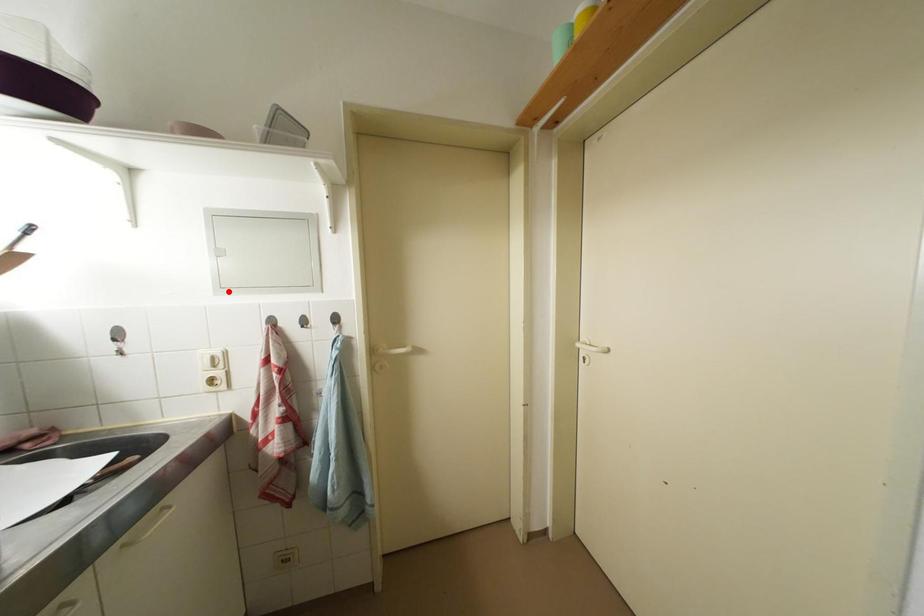
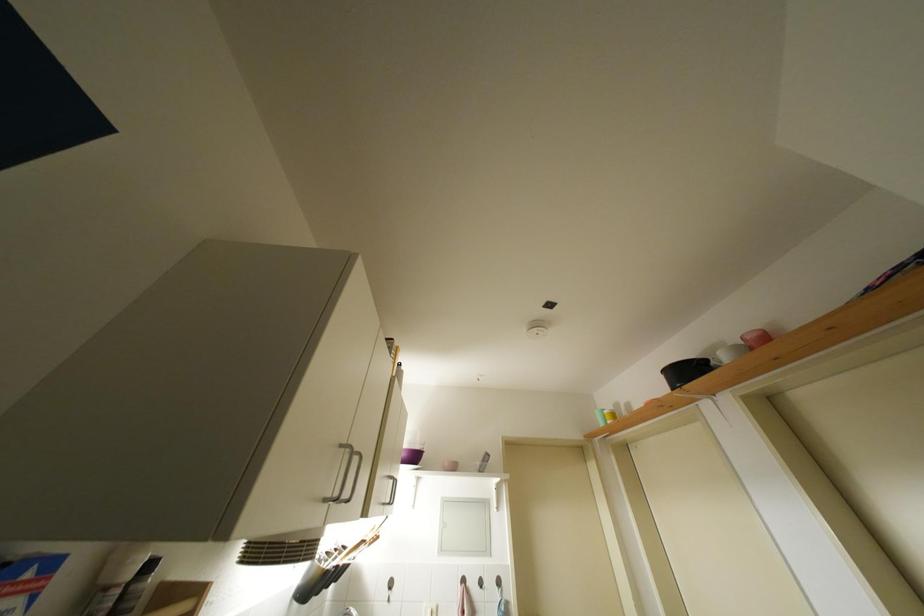
In the second image, find the point that corresponds to the highlighted location in the first image.

(447, 554)